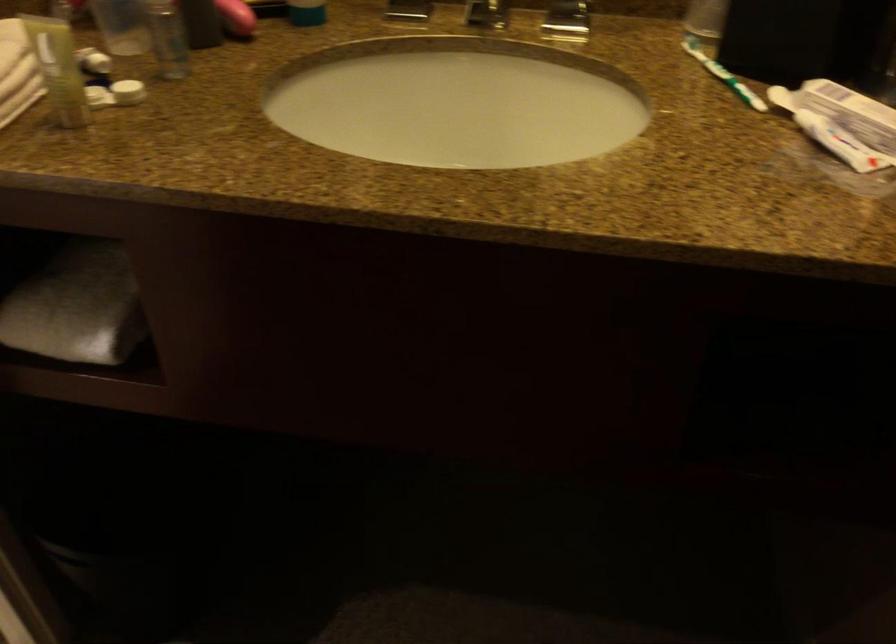
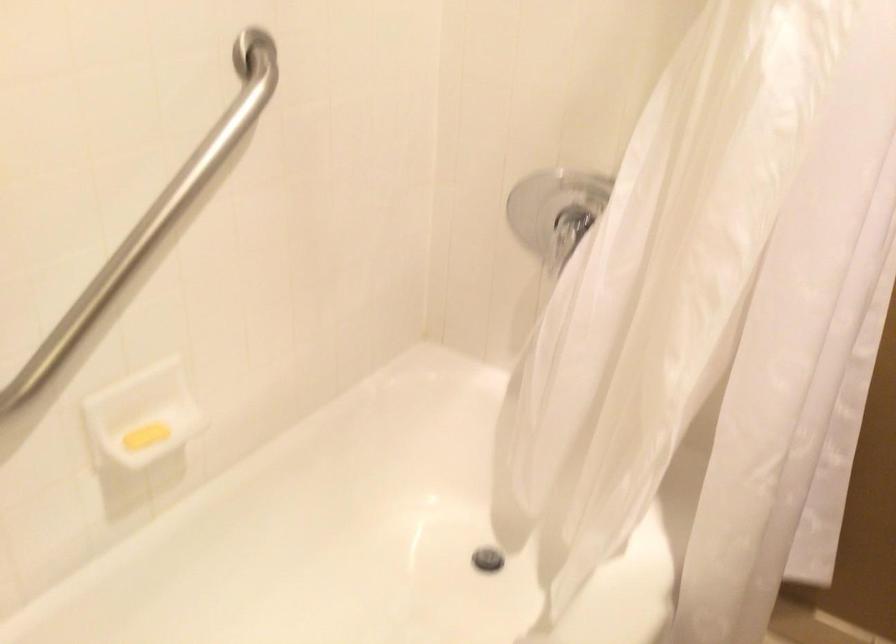
How did the camera likely rotate?

The rotation direction of the camera is left-down.